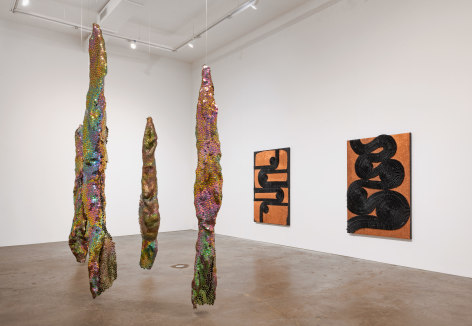
Locate an element on the screen. This screenshot has width=472, height=326. wall is located at coordinates (265, 41).